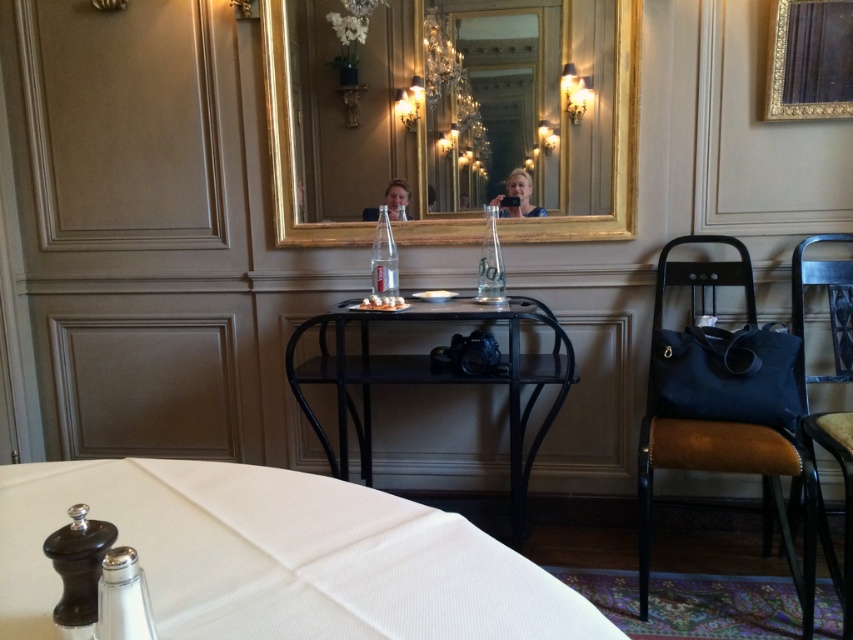
Who is positioned more to the left, leather brown chair at right or black matte table at center?

black matte table at center

Is leather brown chair at right further to camera compared to black matte table at center?

That is False.

Does point (695, 464) lie behind point (375, 368)?

No.

Locate an element on the screen. Image resolution: width=853 pixels, height=640 pixels. leather brown chair at right is located at coordinates (722, 433).

Describe the element at coordinates (722, 433) in the screenshot. This screenshot has height=640, width=853. I see `leather brown chair at right` at that location.

Measure the distance between leather brown chair at right and camera.

leather brown chair at right is 1.90 meters away from camera.

This screenshot has width=853, height=640. What are the coordinates of `leather brown chair at right` in the screenshot? It's located at (722, 433).

Does point (396, 22) lie in front of point (428, 609)?

No, (396, 22) is behind (428, 609).

Who is more forward, (x=422, y=237) or (x=202, y=608)?

Point (x=202, y=608) is more forward.

Locate an element on the screen. gold/gilded mirror at upper center is located at coordinates (451, 115).